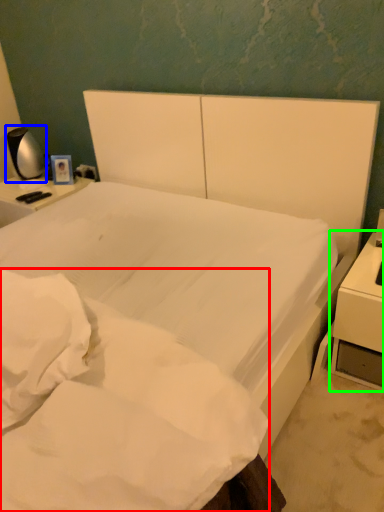
Question: Which object is positioned closest to mattress (highlighted by a red box)? Select from bedside lamp (highlighted by a blue box) and nightstand (highlighted by a green box).

Choices:
 (A) bedside lamp
 (B) nightstand

Answer: (B)